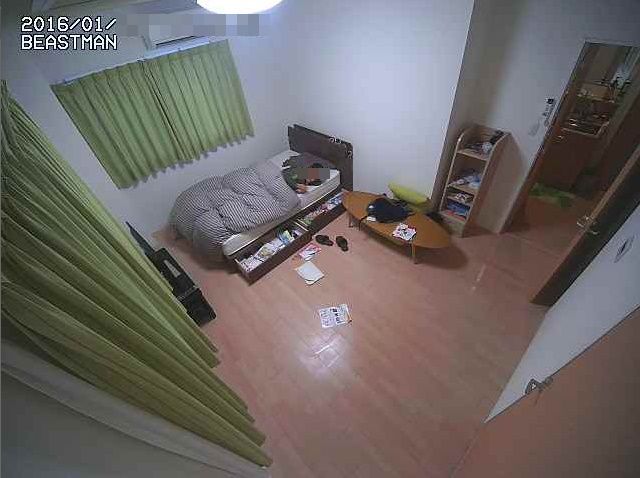
Where is `cabinet in next room`? cabinet in next room is located at coordinates (564, 157).